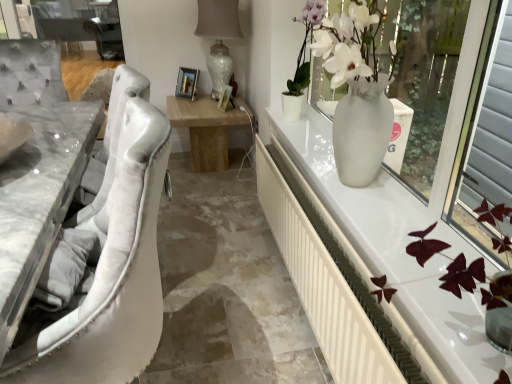
Question: Is white glossy vase at right in front of white marble table at left?

Choices:
 (A) no
 (B) yes

Answer: (A)

Question: From a real-world perspective, is white glossy vase at right over white marble table at left?

Choices:
 (A) yes
 (B) no

Answer: (A)

Question: Can you confirm if white glossy vase at right is shorter than white marble table at left?

Choices:
 (A) yes
 (B) no

Answer: (B)

Question: Is white glossy vase at right oriented away from white marble table at left?

Choices:
 (A) yes
 (B) no

Answer: (B)

Question: Is white glossy vase at right bigger than white marble table at left?

Choices:
 (A) yes
 (B) no

Answer: (A)

Question: From a real-world perspective, is white marble table at left above or below white glossy vase at upper right?

Choices:
 (A) below
 (B) above

Answer: (A)

Question: Would you say white marble table at left is to the left or to the right of white glossy vase at upper right in the picture?

Choices:
 (A) right
 (B) left

Answer: (B)

Question: Is white marble table at left taller or shorter than white glossy vase at upper right?

Choices:
 (A) tall
 (B) short

Answer: (B)

Question: In terms of width, does white marble table at left look wider or thinner when compared to white glossy vase at upper right?

Choices:
 (A) thin
 (B) wide

Answer: (B)

Question: Is white plastic radiator at right spatially inside white glossy vase at right, or outside of it?

Choices:
 (A) inside
 (B) outside

Answer: (B)

Question: Considering their positions, is white plastic radiator at right located in front of or behind white glossy vase at right?

Choices:
 (A) behind
 (B) front

Answer: (B)

Question: Is white plastic radiator at right to the left or to the right of white glossy vase at right in the image?

Choices:
 (A) right
 (B) left

Answer: (B)

Question: In terms of size, does white plastic radiator at right appear bigger or smaller than white glossy vase at right?

Choices:
 (A) big
 (B) small

Answer: (B)

Question: Considering the positions of white plastic radiator at right and white marble table at left in the image, is white plastic radiator at right bigger or smaller than white marble table at left?

Choices:
 (A) small
 (B) big

Answer: (B)

Question: Choose the correct answer: Is white plastic radiator at right inside white marble table at left or outside it?

Choices:
 (A) outside
 (B) inside

Answer: (A)